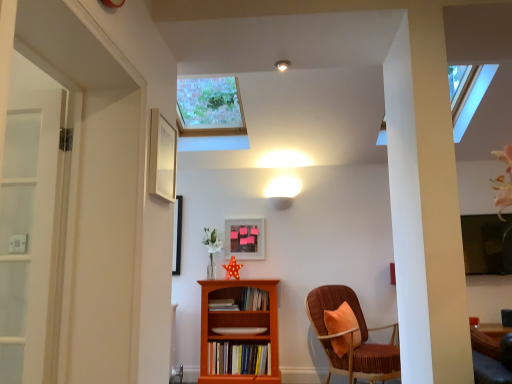
Question: Is orange wood bookcase at center placed right next to velvet brown chair at right?

Choices:
 (A) no
 (B) yes

Answer: (A)

Question: Would you consider orange wood bookcase at center to be distant from velvet brown chair at right?

Choices:
 (A) no
 (B) yes

Answer: (A)

Question: From a real-world perspective, is orange wood bookcase at center under velvet brown chair at right?

Choices:
 (A) no
 (B) yes

Answer: (A)

Question: Does orange wood bookcase at center appear on the left side of velvet brown chair at right?

Choices:
 (A) yes
 (B) no

Answer: (A)

Question: Is orange wood bookcase at center surrounding velvet brown chair at right?

Choices:
 (A) yes
 (B) no

Answer: (B)

Question: Is orange wood bookcase at center facing away from velvet brown chair at right?

Choices:
 (A) no
 (B) yes

Answer: (A)

Question: From the image's perspective, is matte white book at center, acting as the 2th book starting from the bottom, under matte wooden picture frame at center, which appears as the 1th picture frame when viewed from the back?

Choices:
 (A) yes
 (B) no

Answer: (A)

Question: From a real-world perspective, is matte white book at center, the 3th book from the top, located higher than matte wooden picture frame at center, which ranks as the first picture frame in bottom-to-top order?

Choices:
 (A) yes
 (B) no

Answer: (B)

Question: Is matte white book at center, acting as the 2th book starting from the bottom, turned away from matte wooden picture frame at center, placed as the 1th picture frame when sorted from right to left?

Choices:
 (A) yes
 (B) no

Answer: (B)

Question: Could you tell me if matte white book at center, the 3th book from the top, is facing matte wooden picture frame at center, which appears as the 1th picture frame when viewed from the back?

Choices:
 (A) no
 (B) yes

Answer: (A)

Question: Is matte white book at center, the 3th book from the top, positioned before matte wooden picture frame at center, the second picture frame positioned from the left?

Choices:
 (A) no
 (B) yes

Answer: (B)

Question: Is matte wooden picture frame at center, marked as the second picture frame in a top-to-bottom arrangement, a part of matte white book at center, the 3th book from the top?

Choices:
 (A) no
 (B) yes

Answer: (A)

Question: Is wooden book at center, which is the second book in top-to-bottom order, not inside white matte picture frame at upper center, which ranks as the 1th picture frame in left-to-right order?

Choices:
 (A) yes
 (B) no

Answer: (A)